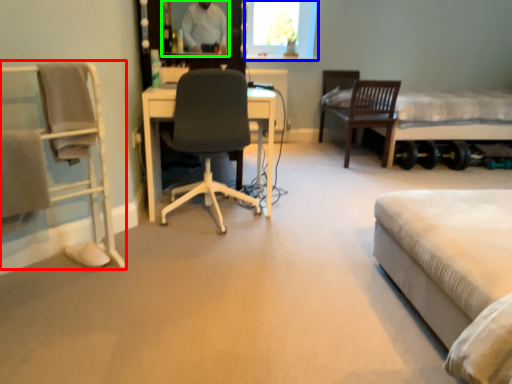
Question: Estimate the real-world distances between objects in this image. Which object is closer to chair (highlighted by a red box), window screen (highlighted by a blue box) or mirror (highlighted by a green box)?

Choices:
 (A) window screen
 (B) mirror

Answer: (B)